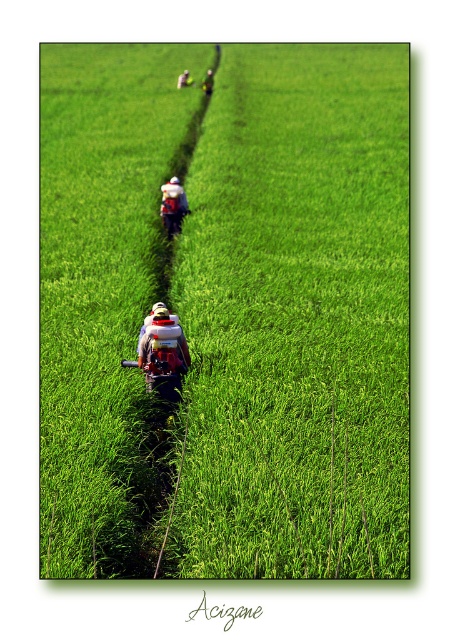
Between green grassy field at center and metallic red sprayer at center, which one is positioned higher?

green grassy field at center

In the scene shown: Is green grassy field at center above metallic red sprayer at center?

Correct, green grassy field at center is located above metallic red sprayer at center.

The image size is (450, 640). What do you see at coordinates (226, 310) in the screenshot?
I see `green grassy field at center` at bounding box center [226, 310].

Identify the location of green grassy field at center. (226, 310).

Is the position of light blue fabric backpack at center more distant than that of camouflage fabric backpack at center?

No, it is not.

Between light blue fabric backpack at center and camouflage fabric backpack at center, which one appears on the left side from the viewer's perspective?

camouflage fabric backpack at center is more to the left.

Is point (175, 202) farther from viewer compared to point (187, 74)?

No, it is not.

Identify the location of light blue fabric backpack at center. Image resolution: width=450 pixels, height=640 pixels. (174, 196).

How far apart are metallic red sprayer at center and light blue fabric backpack at center?

The distance of metallic red sprayer at center from light blue fabric backpack at center is 9.11 meters.

Between point (148, 326) and point (162, 192), which one is positioned in front?

Point (148, 326)

Is point (160, 323) more distant than point (179, 211)?

No, it is not.

Where is `metallic red sprayer at center`? This screenshot has height=640, width=450. metallic red sprayer at center is located at coordinates (162, 328).